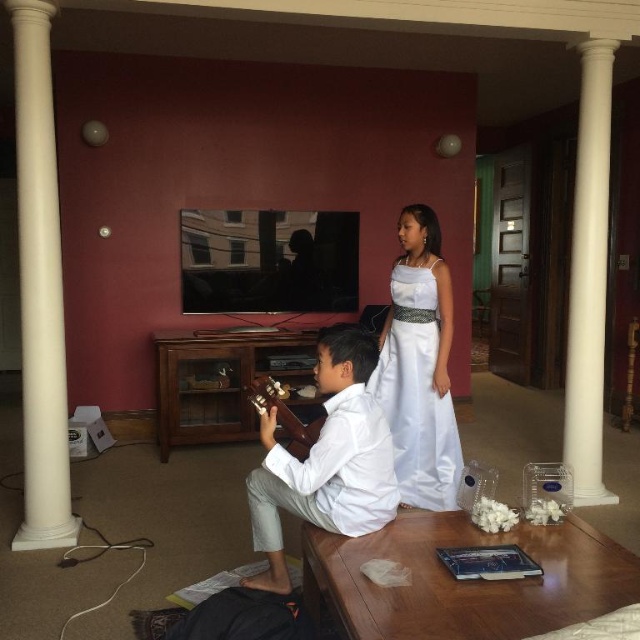
You are standing at the point labeled as point (19,161) in the room. The television is mounted on the wall. If you want to watch the television clearly, would you be able to see it without moving from your current position?

The point (19,161) is 2.92 meters away from the viewer. Since the television is mounted on the wall, and assuming typical TV viewing distances, the viewer can likely see the television clearly from that position without needing to move.